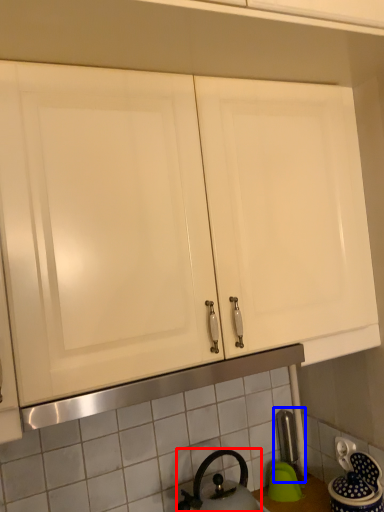
Question: Among these objects, which one is nearest to the camera, kettle (highlighted by a red box) or faucet (highlighted by a blue box)?

Choices:
 (A) kettle
 (B) faucet

Answer: (A)